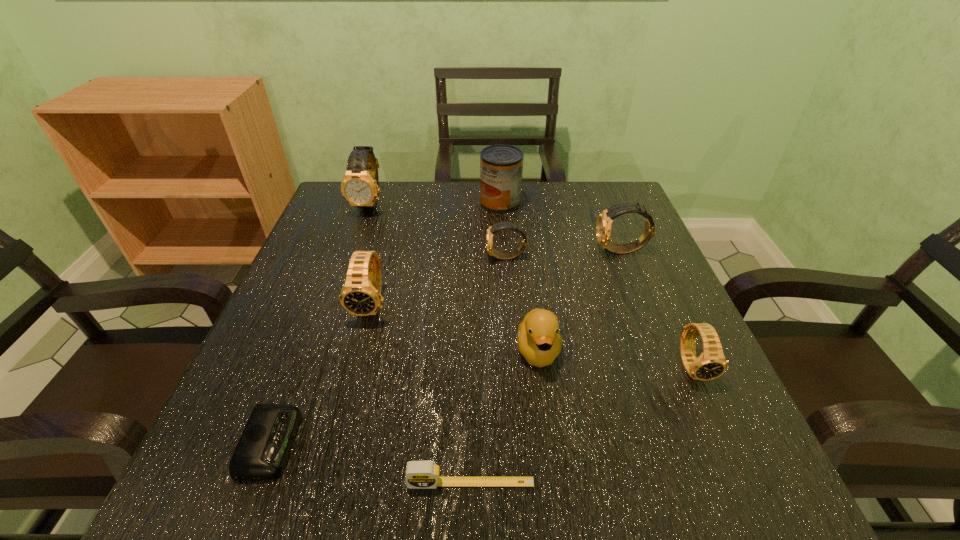
Locate an element on the screen. The height and width of the screenshot is (540, 960). vacant space in between the shortest object and the farther black watch is located at coordinates (322, 374).

You are a GUI agent. You are given a task and a screenshot of the screen. Output one action in this format:
    pyautogui.click(x=<x>, y=<y>)
    Task: Click on the blank region between the duckling and the smallest gold watch
    
    Given the screenshot: What is the action you would take?
    pyautogui.click(x=522, y=304)

The height and width of the screenshot is (540, 960). In order to click on blank region between the shortest object and the duckling in this screenshot , I will do `click(405, 397)`.

Locate an element on the screen. This screenshot has width=960, height=540. vacant area between the rightmost gold watch and the can is located at coordinates (561, 227).

The image size is (960, 540). What are the coordinates of `vacant region between the second gold watch from left to right and the nearest watch` in the screenshot? It's located at (600, 312).

You are a GUI agent. You are given a task and a screenshot of the screen. Output one action in this format:
    pyautogui.click(x=<x>, y=<y>)
    Task: Click on the empty location between the duckling and the second gold watch from right to left
    The width and height of the screenshot is (960, 540).
    Given the screenshot: What is the action you would take?
    pyautogui.click(x=522, y=304)

Identify the location of free space that is in between the rightmost gold watch and the duckling. (580, 301).

I want to click on free space between the bigger black watch and the red can, so click(436, 254).

The height and width of the screenshot is (540, 960). I want to click on vacant space that is in between the second shortest object and the can, so click(x=486, y=343).

Identify the location of empty space between the red can and the rightmost gold watch. This screenshot has height=540, width=960. (561, 227).